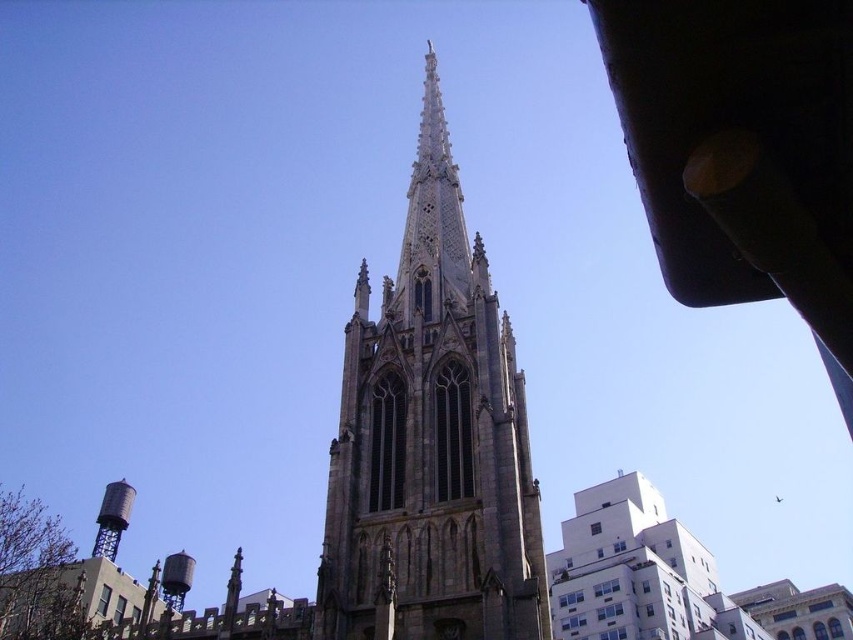
You are standing in front of a Gothic church and want to take a photo of the brown stone tower at center. If your camera can focus on objects up to 50 meters away, will you be able to capture the tower clearly?

The brown stone tower at center is 55.95 meters away from the viewer, which is beyond the camera focus range of 50 meters. Therefore, the camera cannot capture the tower clearly.

You are an architect analyzing the image of a Gothic church and its surroundings. Based on the scene, which object, the brown stone tower at center or the silver metallic water tower at lower left, is taller?

The brown stone tower at center is taller than the silver metallic water tower at lower left according to the description.

You are standing in front of the Gothic church scene. You notice the brown stone tower at center. Based on its 2D location coordinates, can you determine if it is positioned more to the left or right side of the image?

The brown stone tower at center is located at coordinates point [431,440], which places it closer to the right side of the image.